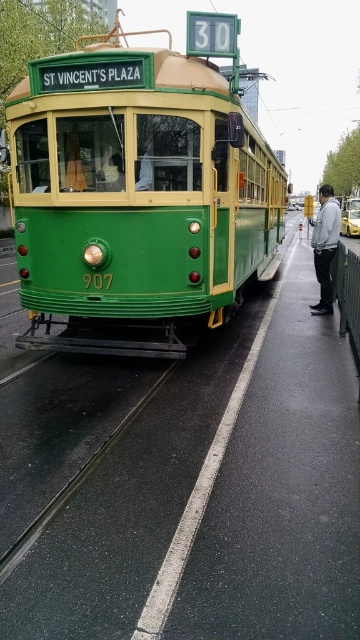
You are a pedestrian standing at the edge of the wet road and see the gray fabric jacket at center and the yellow metallic taxi at center. Which object is bigger?

The gray fabric jacket at center is larger in size compared to the yellow metallic taxi at center.

You are a pedestrian standing on the wet road and see the green polished tram at center and the gray fabric jacket at center. Which object is located to the right?

The gray fabric jacket at center is located to the right of the green polished tram at center.